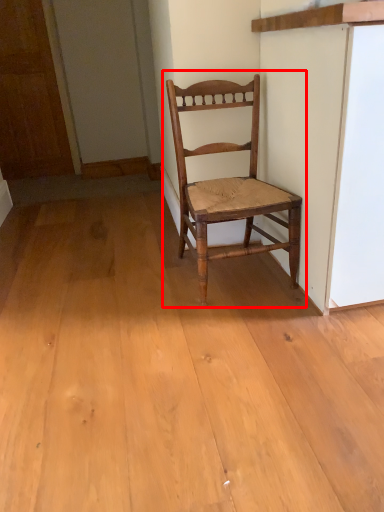
Question: From the image's perspective, where is chair (annotated by the red box) located in relation to door in the image?

Choices:
 (A) below
 (B) above

Answer: (A)